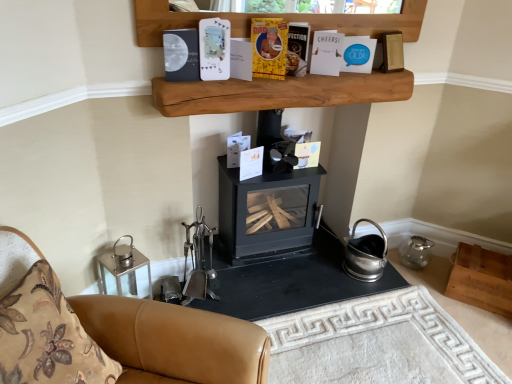
Where is `vacant region in front of wooden box at lower right, the 2th shelf viewed from the top`? The width and height of the screenshot is (512, 384). vacant region in front of wooden box at lower right, the 2th shelf viewed from the top is located at coordinates (486, 323).